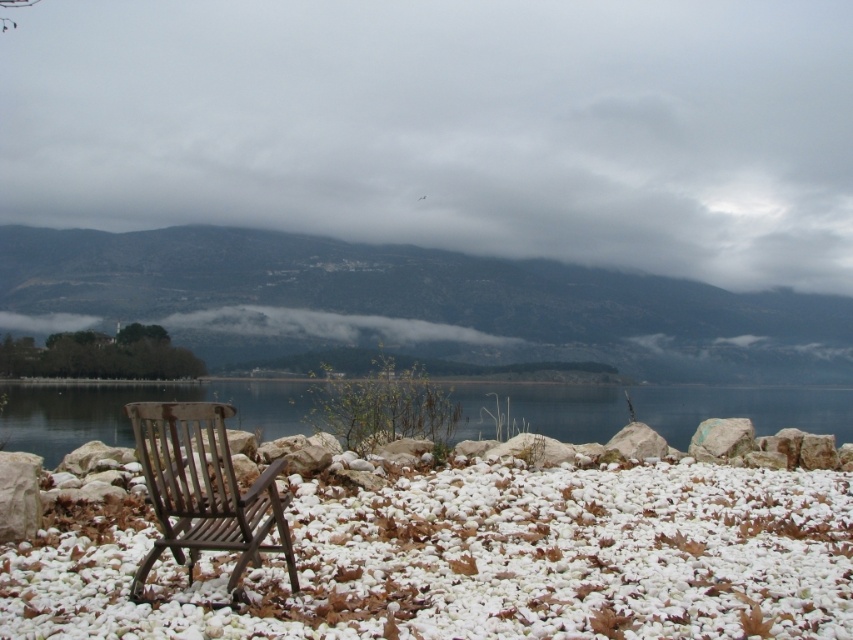
You are an artist planning to paint the lakeside scene. You want to ensure the dark green forested mountain at left and the transparent glass water at center are proportionally accurate. Which of these two elements should you make wider in your painting?

The dark green forested mountain at left should be made wider in the painting since its width is larger than the transparent glass water at center according to the description.

You are standing at the origin point of the coordinate system. You want to place a small statue exactly at the white gravel at center. What are the coordinates where you should place the statue?

The coordinates for the white gravel at center are at point (x=482, y=561), so you should place the statue at those coordinates.